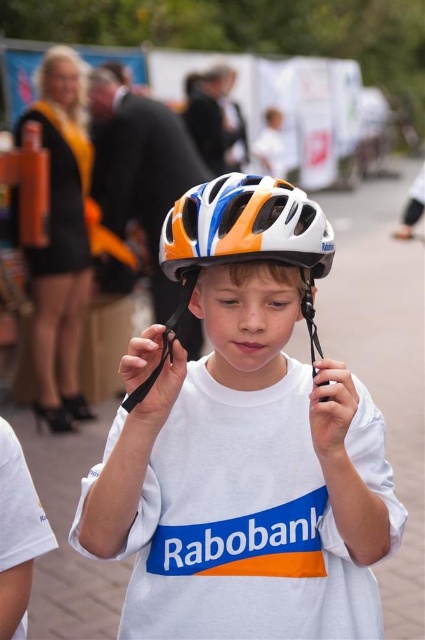
Is matte black dress at upper left thinner than matte black helmet at upper center?

No, matte black dress at upper left is not thinner than matte black helmet at upper center.

Between matte black dress at upper left and matte black helmet at upper center, which one is positioned higher?

Positioned higher is matte black helmet at upper center.

Is point (62, 362) positioned behind point (90, 99)?

No, (62, 362) is in front of (90, 99).

Where is `matte black dress at upper left`? This screenshot has height=640, width=425. matte black dress at upper left is located at coordinates (61, 244).

Who is more forward, (56,426) or (221,83)?

Point (56,426) is in front.

Based on the photo, which is more to the right, matte black dress at upper left or white matte helmet at center?

From the viewer's perspective, white matte helmet at center appears more on the right side.

Which is behind, point (40, 390) or point (204, 88)?

Positioned behind is point (204, 88).

At what (x,y) coordinates should I click in order to perform the action: click on matte black dress at upper left. Please return your answer as a coordinate pair (x, y). Looking at the image, I should click on (61, 244).

Can you confirm if shiny multicolored helmet at center is smaller than white matte helmet at center?

Correct, shiny multicolored helmet at center occupies less space than white matte helmet at center.

Does point (195, 481) come closer to viewer compared to point (224, 84)?

That is True.

What do you see at coordinates (246, 444) in the screenshot? This screenshot has height=640, width=425. I see `shiny multicolored helmet at center` at bounding box center [246, 444].

This screenshot has width=425, height=640. I want to click on shiny multicolored helmet at center, so click(x=246, y=444).